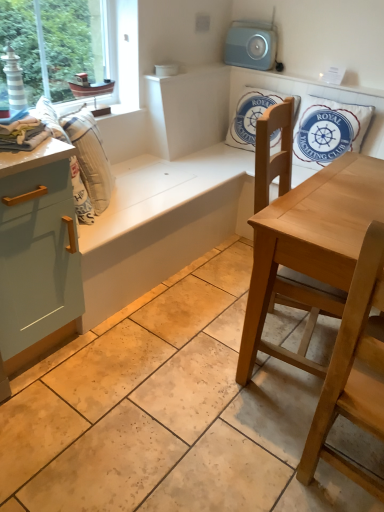
This screenshot has width=384, height=512. Find the location of `blank space to the left of light wood chair at lower right, marked as the 1th chair in a front-to-back arrangement`. blank space to the left of light wood chair at lower right, marked as the 1th chair in a front-to-back arrangement is located at coordinates (248, 449).